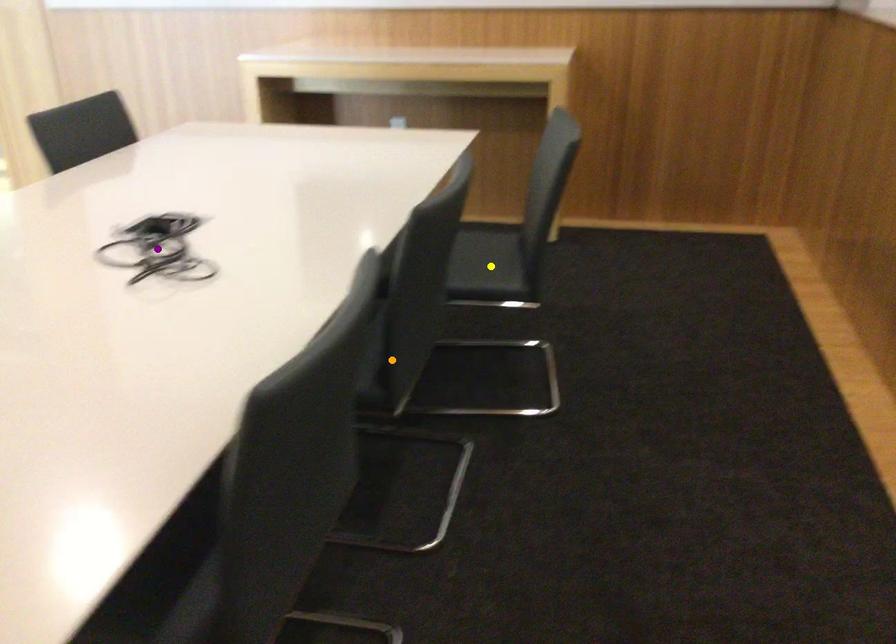
Order these from farthest to nearest:
- purple point
- yellow point
- orange point

yellow point < orange point < purple point